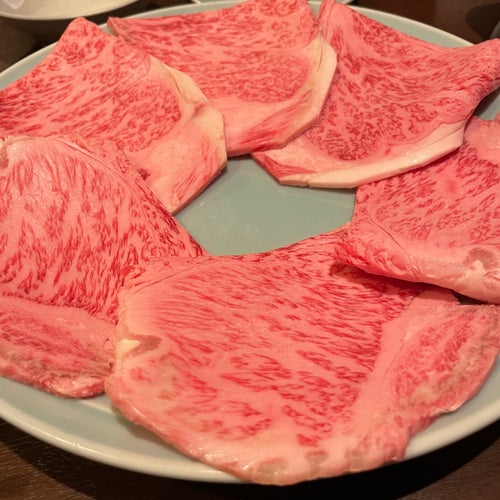
The image size is (500, 500). I want to click on teal/gray plate, so click(x=231, y=209).